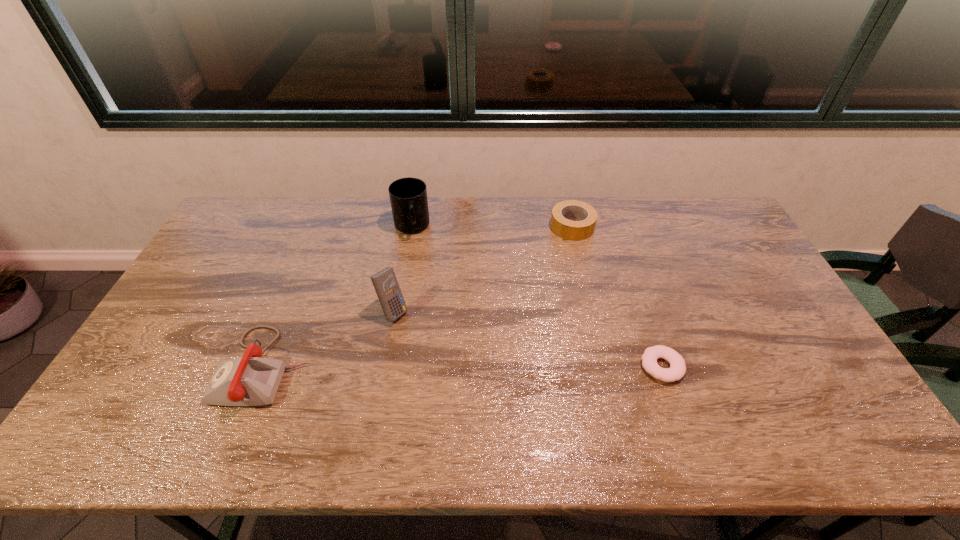
Where is `vacant area between the shortest object and the mug`? This screenshot has height=540, width=960. vacant area between the shortest object and the mug is located at coordinates (537, 297).

Locate an element on the screen. vacant area that lies between the telephone and the calculator is located at coordinates (329, 339).

This screenshot has width=960, height=540. Identify the location of vacant region between the mug and the fourth object from left to right. (492, 227).

Where is `empty space between the duct tape and the rightmost object`? empty space between the duct tape and the rightmost object is located at coordinates (617, 296).

The width and height of the screenshot is (960, 540). What are the coordinates of `empty space between the third farthest object and the mug` in the screenshot? It's located at (402, 269).

At what (x,y) coordinates should I click in order to perform the action: click on free space between the third farthest object and the fourth tallest object. Please return your answer as a coordinate pair (x, y). The image size is (960, 540). Looking at the image, I should click on (483, 269).

This screenshot has width=960, height=540. Find the location of `free space between the shortest object and the third farthest object`. free space between the shortest object and the third farthest object is located at coordinates (527, 339).

Where is `unoccupied position between the fourth object from left to right and the third tallest object`? The image size is (960, 540). unoccupied position between the fourth object from left to right and the third tallest object is located at coordinates (419, 296).

This screenshot has width=960, height=540. Find the location of `empty space between the third nearest object and the duct tape`. empty space between the third nearest object and the duct tape is located at coordinates (483, 269).

Identify which object is the closest to the third nearest object. Please provide its 2D coordinates. Your answer should be formatted as a tuple, i.e. [(x, y)], where the tuple contains the x and y coordinates of a point satisfying the conditions above.

[(250, 380)]